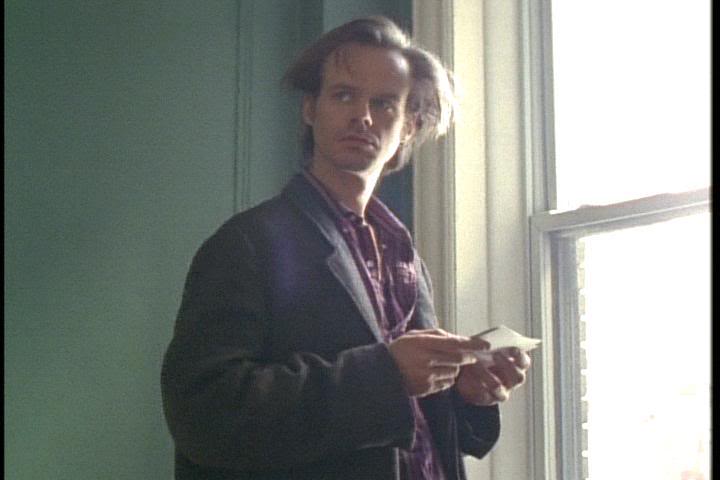
The image size is (720, 480). I want to click on window, so click(x=649, y=348).